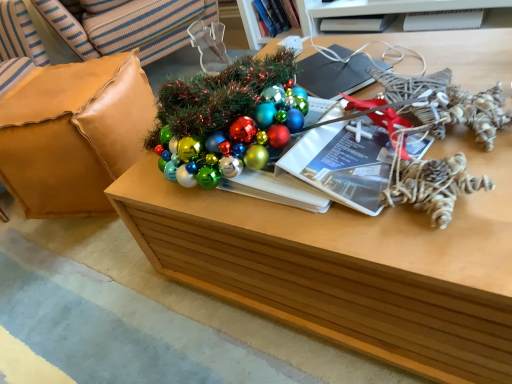
Question: Is leather cushion at left positioned with its back to twisted rope ornament at right?

Choices:
 (A) yes
 (B) no

Answer: (B)

Question: Does leather cushion at left appear on the right side of twisted rope ornament at right?

Choices:
 (A) no
 (B) yes

Answer: (A)

Question: Is leather cushion at left touching twisted rope ornament at right?

Choices:
 (A) yes
 (B) no

Answer: (B)

Question: Does leather cushion at left have a greater height compared to twisted rope ornament at right?

Choices:
 (A) yes
 (B) no

Answer: (A)

Question: Can you confirm if leather cushion at left is smaller than twisted rope ornament at right?

Choices:
 (A) yes
 (B) no

Answer: (B)

Question: From the image's perspective, relative to hardcover book at upper center, the 1th book viewed from the left, is white plastic magazine at upper right, acting as the 1th magazine starting from the back, above or below?

Choices:
 (A) below
 (B) above

Answer: (A)

Question: Considering the positions of point (415, 16) and point (268, 29), is point (415, 16) closer or farther from the camera than point (268, 29)?

Choices:
 (A) farther
 (B) closer

Answer: (B)

Question: In the image, is white plastic magazine at upper right, the 1th magazine from the right, positioned in front of or behind hardcover book at upper center, the 1th book viewed from the left?

Choices:
 (A) behind
 (B) front

Answer: (B)

Question: Considering the positions of white plastic magazine at upper right, the 1th magazine from the right, and hardcover book at upper center, which is the second book in right-to-left order, in the image, is white plastic magazine at upper right, the 1th magazine from the right, bigger or smaller than hardcover book at upper center, which is the second book in right-to-left order,?

Choices:
 (A) small
 (B) big

Answer: (A)

Question: In terms of height, does wooden table at center look taller or shorter compared to leather cushion at left?

Choices:
 (A) short
 (B) tall

Answer: (A)

Question: Is point (388, 259) positioned closer to the camera than point (131, 84)?

Choices:
 (A) closer
 (B) farther

Answer: (A)

Question: Based on their sizes in the image, would you say wooden table at center is bigger or smaller than leather cushion at left?

Choices:
 (A) big
 (B) small

Answer: (A)

Question: Would you say wooden table at center is to the left or to the right of leather cushion at left in the picture?

Choices:
 (A) right
 (B) left

Answer: (A)

Question: Would you say white matte book at upper center, which appears as the second book when viewed from the left, is inside or outside matte paper magazine at center, arranged as the 1th magazine when viewed from the left?

Choices:
 (A) outside
 (B) inside

Answer: (A)

Question: Relative to matte paper magazine at center, which is counted as the third magazine, starting from the right, is white matte book at upper center, which appears as the second book when viewed from the left, in front or behind?

Choices:
 (A) front
 (B) behind

Answer: (B)